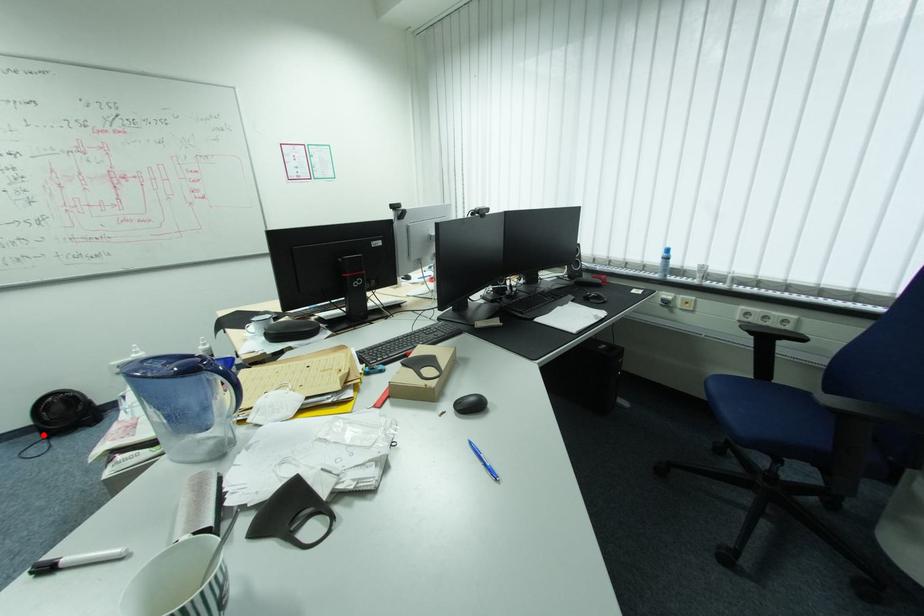
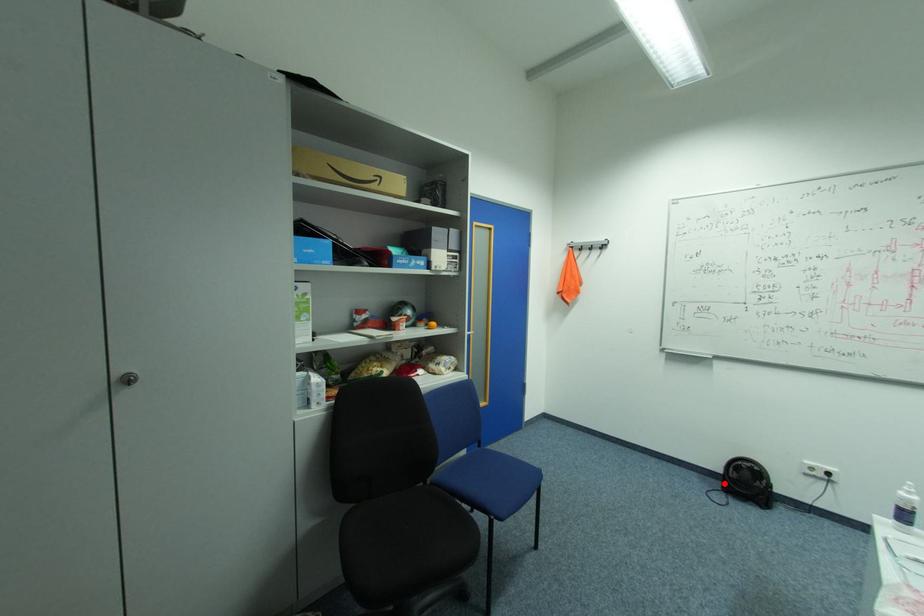
I am providing you with two images of the same scene from different viewpoints. A red point is marked on the first image and another point is marked on the second image. Is the red point in image1 aligned with the point shown in image2?

Yes